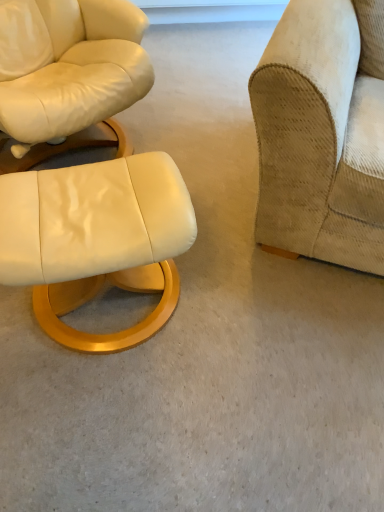
Identify the location of vacant region to the right of matte white leather ottoman at lower left. This screenshot has width=384, height=512. (244, 311).